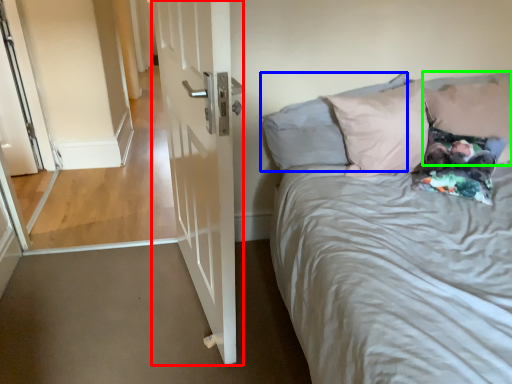
Question: Which object is the farthest from door (highlighted by a red box)? Choose among these: pillow (highlighted by a blue box) or pillow (highlighted by a green box).

Choices:
 (A) pillow
 (B) pillow

Answer: (B)